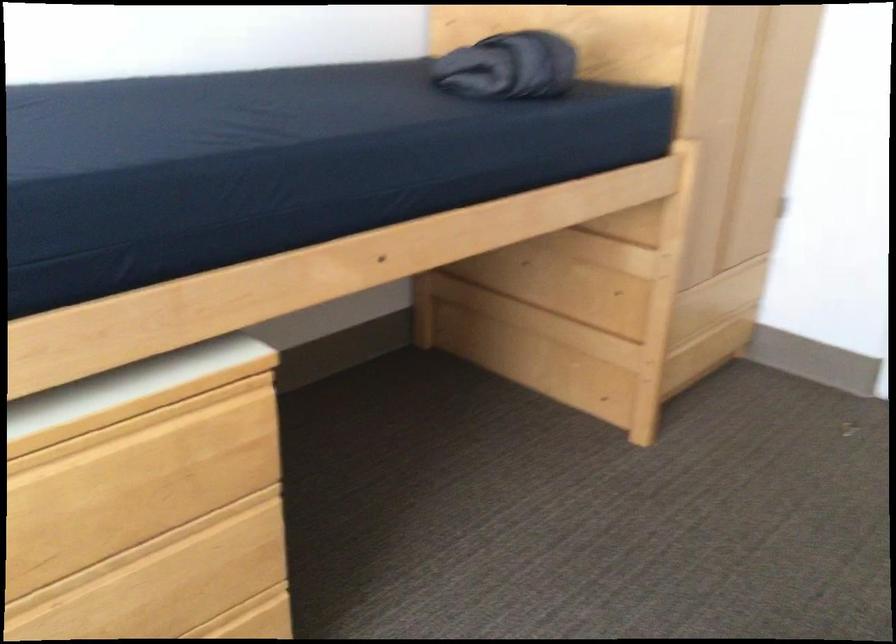
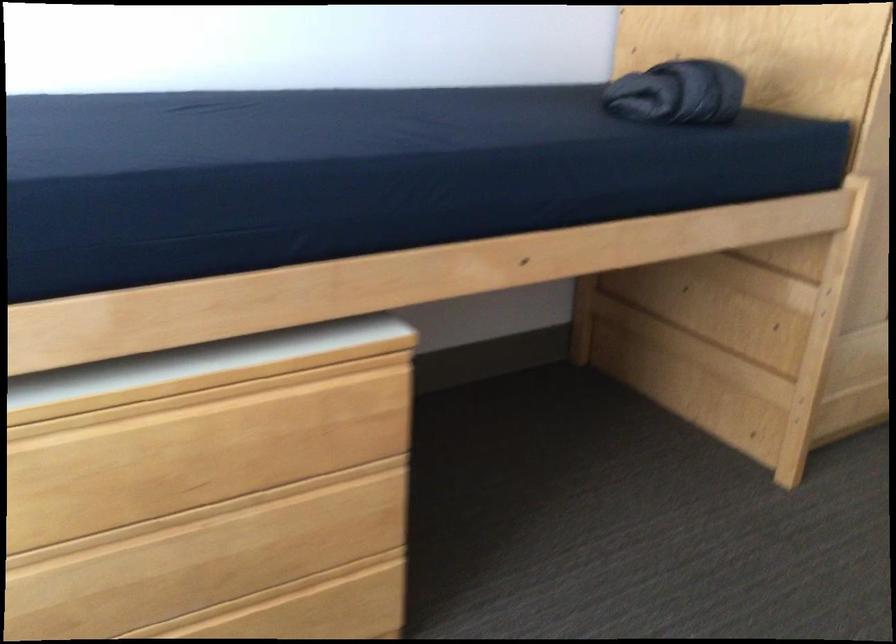
Question: How did the camera likely rotate?

Choices:
 (A) Left
 (B) Right
 (C) Up
 (D) Down

Answer: (A)